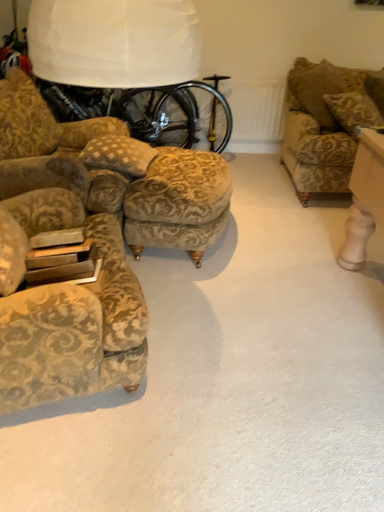
Question: Can you confirm if gold-patterned fabric couch at upper right is smaller than velvet floral armchair at left?

Choices:
 (A) no
 (B) yes

Answer: (B)

Question: Does gold-patterned fabric couch at upper right come in front of velvet floral armchair at left?

Choices:
 (A) no
 (B) yes

Answer: (A)

Question: From a real-world perspective, is gold-patterned fabric couch at upper right under velvet floral armchair at left?

Choices:
 (A) yes
 (B) no

Answer: (B)

Question: Can you confirm if gold-patterned fabric couch at upper right is shorter than velvet floral armchair at left?

Choices:
 (A) yes
 (B) no

Answer: (A)

Question: Is gold-patterned fabric couch at upper right wider than velvet floral armchair at left?

Choices:
 (A) yes
 (B) no

Answer: (B)

Question: Is velvet floral armchair at left inside gold-patterned fabric couch at upper right?

Choices:
 (A) no
 (B) yes

Answer: (A)

Question: Can you confirm if patterned fabric pillow at center is taller than gold-patterned fabric stool at center?

Choices:
 (A) no
 (B) yes

Answer: (A)

Question: Is patterned fabric pillow at center at the left side of gold-patterned fabric stool at center?

Choices:
 (A) no
 (B) yes

Answer: (B)

Question: Can you confirm if patterned fabric pillow at center is smaller than gold-patterned fabric stool at center?

Choices:
 (A) yes
 (B) no

Answer: (A)

Question: From the image's perspective, is patterned fabric pillow at center on top of gold-patterned fabric stool at center?

Choices:
 (A) yes
 (B) no

Answer: (A)

Question: Is patterned fabric pillow at center outside gold-patterned fabric stool at center?

Choices:
 (A) yes
 (B) no

Answer: (A)

Question: From a real-world perspective, does patterned fabric pillow at center stand above gold-patterned fabric stool at center?

Choices:
 (A) yes
 (B) no

Answer: (A)

Question: From a real-world perspective, is velvet floral armchair at left physically below patterned fabric pillow at center?

Choices:
 (A) no
 (B) yes

Answer: (B)